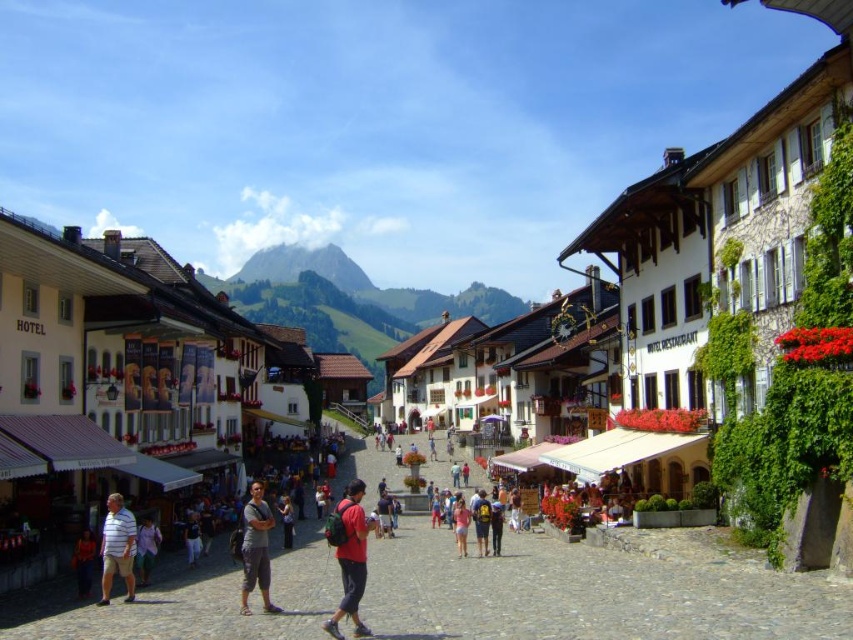
Does gray cotton pants at center have a greater width compared to pink fabric shorts at center?

Indeed, gray cotton pants at center has a greater width compared to pink fabric shorts at center.

Who is shorter, gray cotton pants at center or pink fabric shorts at center?

Standing shorter between the two is pink fabric shorts at center.

Locate an element on the screen. The image size is (853, 640). gray cotton pants at center is located at coordinates coord(256,548).

At what (x,y) coordinates should I click in order to perform the action: click on gray cotton pants at center. Please return your answer as a coordinate pair (x, y). The width and height of the screenshot is (853, 640). Looking at the image, I should click on (256, 548).

Who is positioned more to the right, striped cotton shirt at center or pink fabric shorts at center?

pink fabric shorts at center is more to the right.

Can you confirm if striped cotton shirt at center is positioned to the right of pink fabric shorts at center?

In fact, striped cotton shirt at center is to the left of pink fabric shorts at center.

Where is `striped cotton shirt at center`? The width and height of the screenshot is (853, 640). striped cotton shirt at center is located at coordinates (117, 547).

Identify the location of striped cotton shirt at center. This screenshot has width=853, height=640. (117, 547).

Can you confirm if gray cotton pants at center is positioned below dark blue backpack at center?

Actually, gray cotton pants at center is above dark blue backpack at center.

Does gray cotton pants at center come behind dark blue backpack at center?

No, it is in front of dark blue backpack at center.

Where is `gray cotton pants at center`? gray cotton pants at center is located at coordinates (256, 548).

This screenshot has width=853, height=640. In order to click on gray cotton pants at center in this screenshot , I will do `click(256, 548)`.